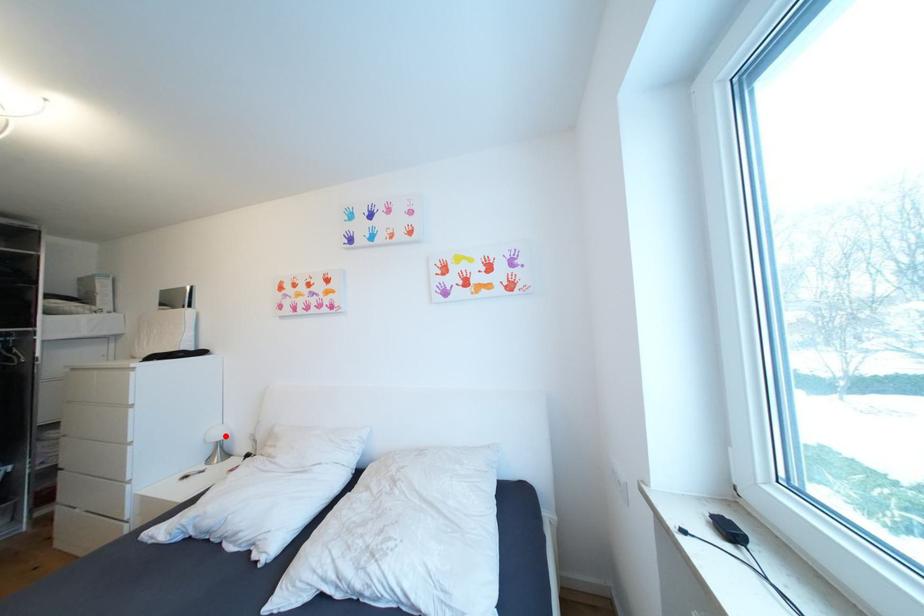
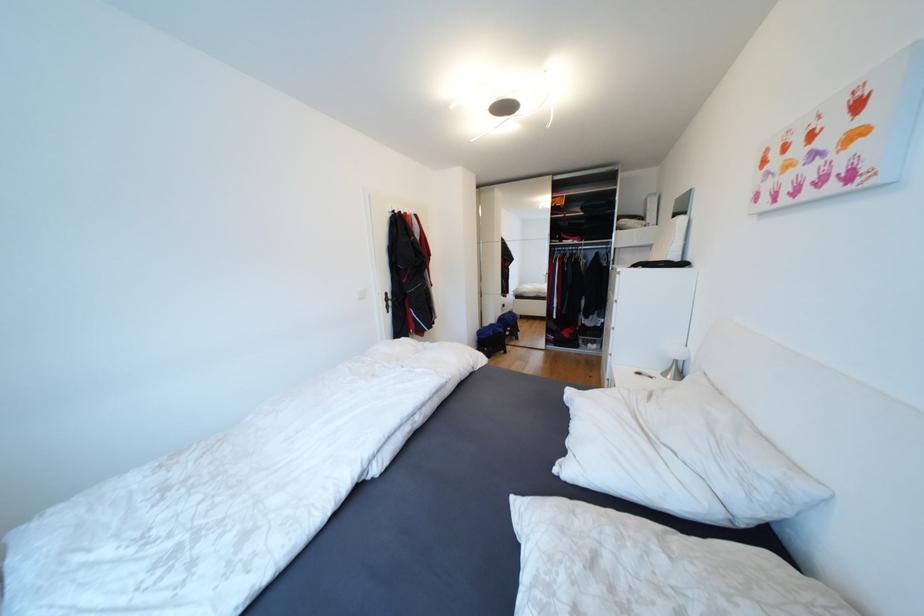
Question: I am providing you with two images of the same scene from different viewpoints. A red point is shown in image1. For the corresponding object point in image2, is it positioned nearer or farther from the camera?

Choices:
 (A) Nearer
 (B) Farther

Answer: (A)